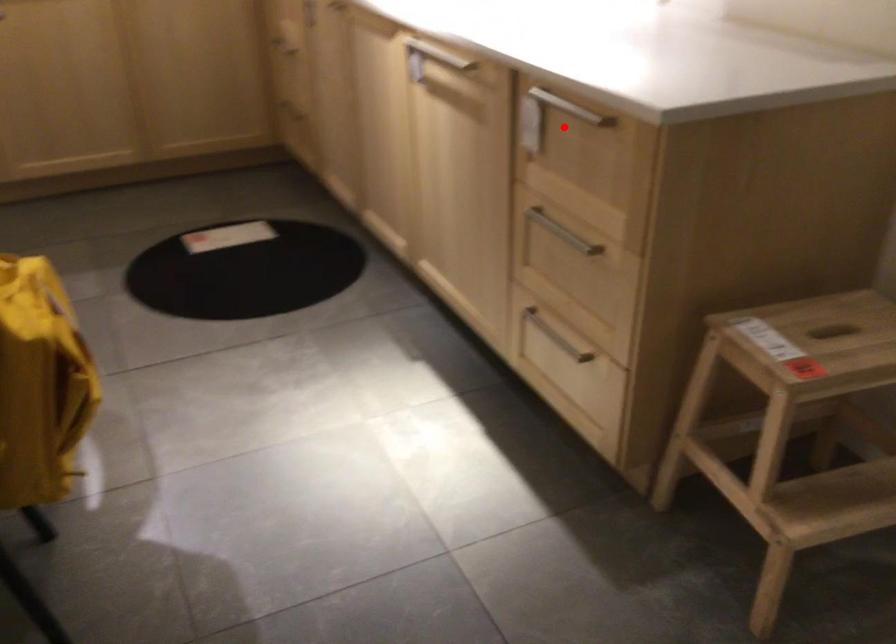
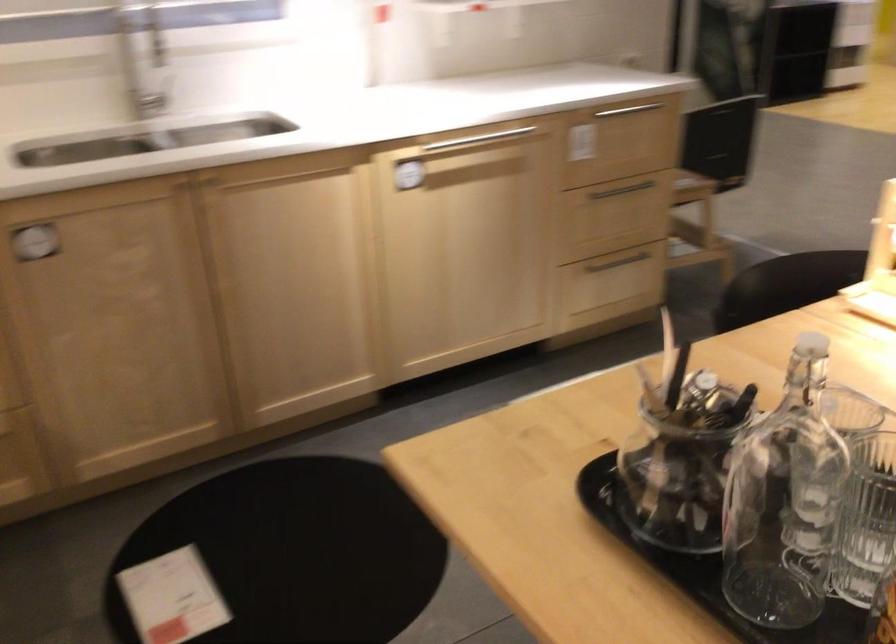
Where in the second image is the point corresponding to the highlighted location from the first image?

(640, 118)